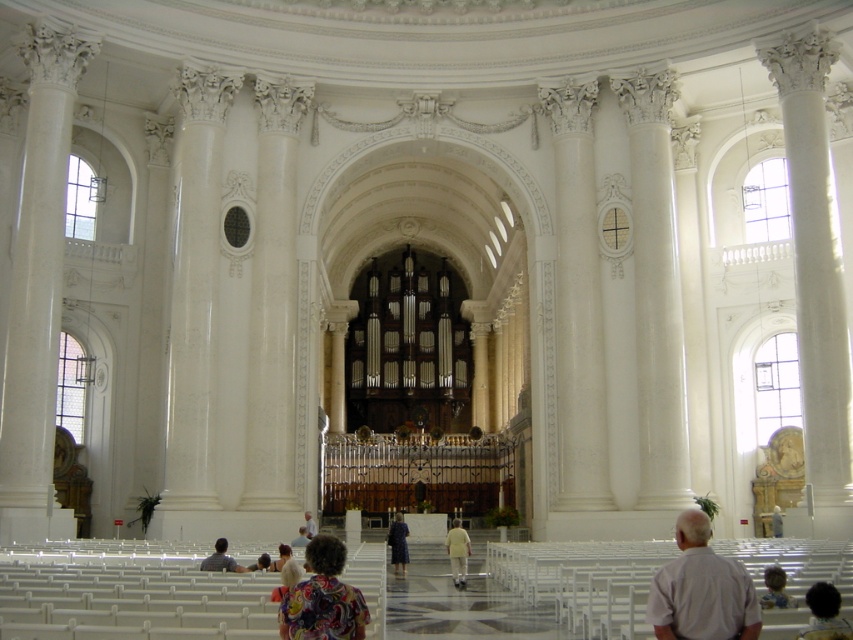
You are standing at the entrance of the church and want to move towards the point labeled as point (x=766, y=593). However, there is an obstacle at point (x=262, y=561). Can you reach your destination without passing through the obstacle?

Since point (x=766, y=593) is in front of point (x=262, y=561), you can reach the destination without passing through the obstacle by moving around it.

You are standing at the entrance of the church and see the dark blue fabric coat at center and the light brown leather jacket at lower right. Which one is positioned more to the right side of the scene?

The light brown leather jacket at lower right is positioned more to the right side of the scene.

You are standing in the grand church and see a person with light brown hair at lower right and a person wearing a floral fabric dress at lower center. Which person is more to the right?

The light brown hair at lower right is more to the right than the floral fabric dress at lower center.